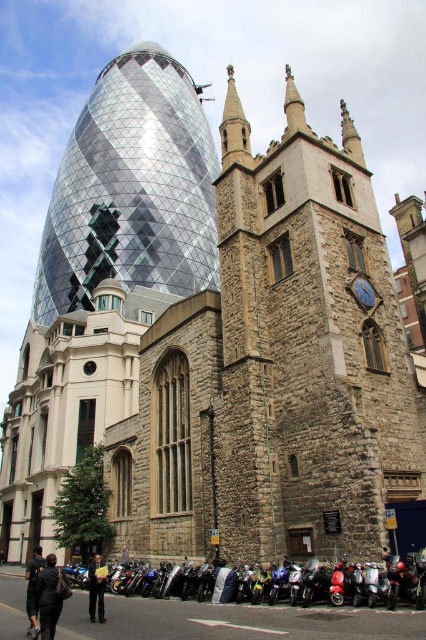
Question: Which point appears farthest from the camera in this image?

Choices:
 (A) (28, 595)
 (B) (46, 616)

Answer: (A)

Question: Which of the following is the farthest from the observer?

Choices:
 (A) (46, 609)
 (B) (126, 545)
 (C) (29, 588)

Answer: (B)

Question: Which point appears farthest from the camera in this image?

Choices:
 (A) (98, 234)
 (B) (37, 621)
 (C) (45, 628)

Answer: (A)

Question: Is shiny glass tower at center in front of dark gray suit at lower left?

Choices:
 (A) yes
 (B) no

Answer: (B)

Question: From the image, what is the correct spatial relationship of dark blue jacket at lower left in relation to dark gray jacket at center?

Choices:
 (A) right
 (B) left

Answer: (B)

Question: In this image, where is shiny glass tower at center located relative to dark gray jacket at center?

Choices:
 (A) above
 (B) below

Answer: (A)